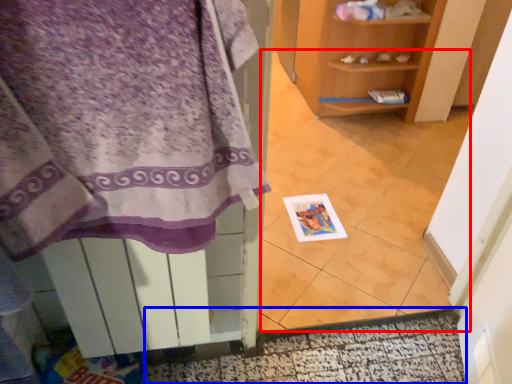
Question: Among these objects, which one is nearest to the camera, tile (highlighted by a red box) or door (highlighted by a blue box)?

Choices:
 (A) tile
 (B) door

Answer: (A)